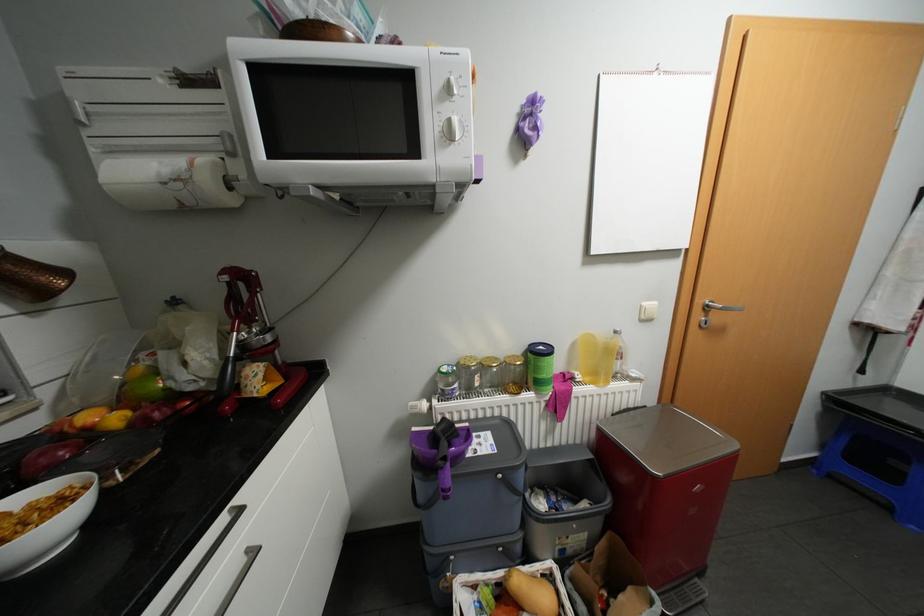
This screenshot has height=616, width=924. What do you see at coordinates (714, 310) in the screenshot?
I see `a silver door handle` at bounding box center [714, 310].